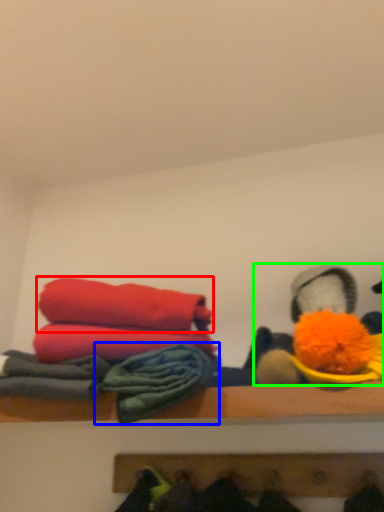
Question: Estimate the real-world distances between objects in this image. Which object is farther from towel (highlighted by a red box), material (highlighted by a blue box) or toy (highlighted by a green box)?

Choices:
 (A) material
 (B) toy

Answer: (B)